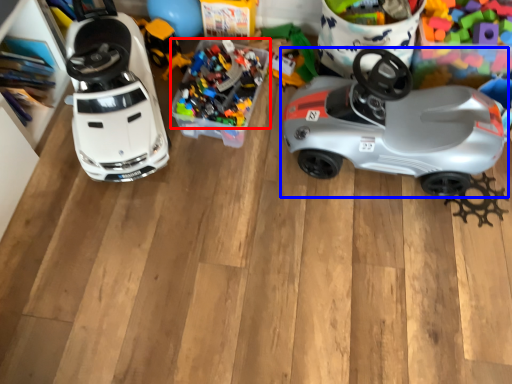
Question: Which object appears closest to the camera in this image, toy (highlighted by a red box) or car (highlighted by a blue box)?

Choices:
 (A) toy
 (B) car

Answer: (B)